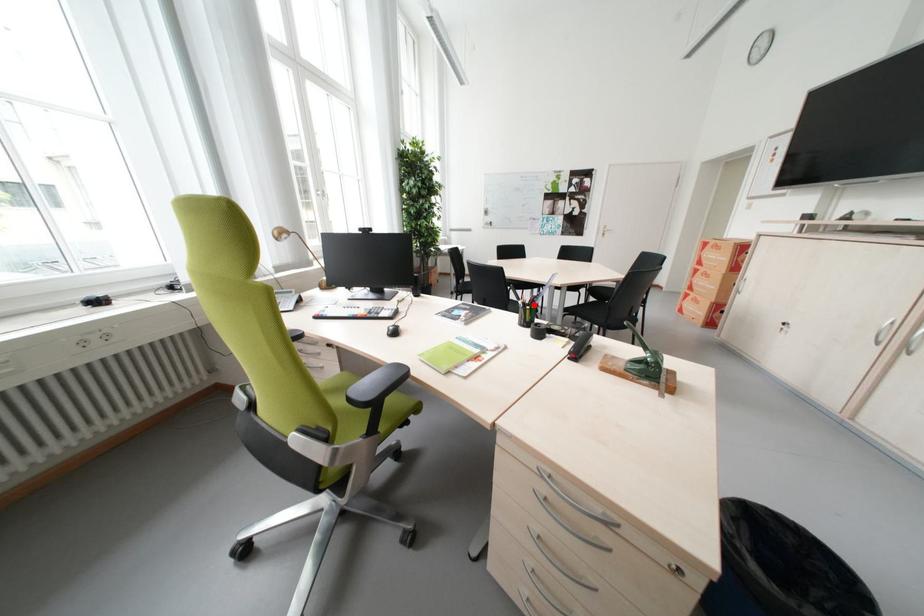
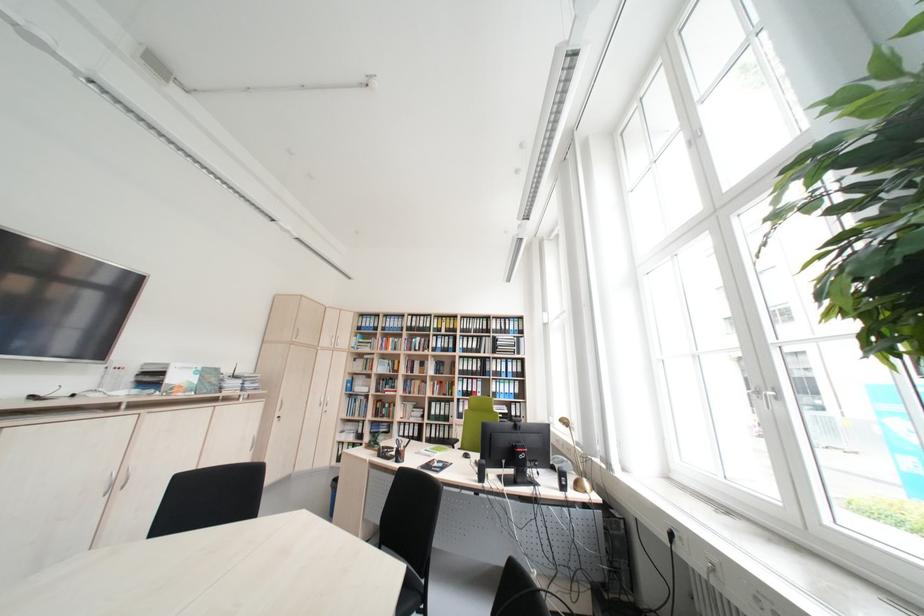
Question: I am providing you with two images of the same scene from different viewpoints. A red point is marked on the first image. Can you still see the location of the red point in image 2?

Choices:
 (A) Yes
 (B) No

Answer: (B)